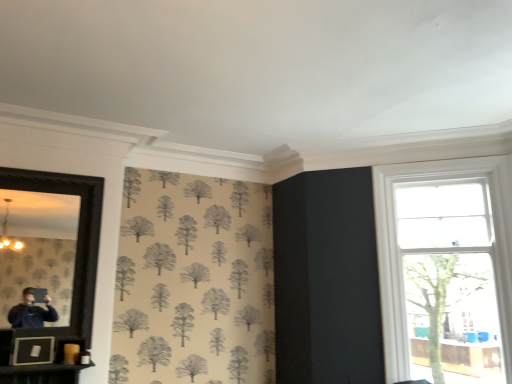
This screenshot has width=512, height=384. What do you see at coordinates (33, 350) in the screenshot?
I see `matte black picture frame at lower left` at bounding box center [33, 350].

This screenshot has width=512, height=384. Describe the element at coordinates (446, 268) in the screenshot. I see `clear glass window at right` at that location.

Where is `black framed mirror at left`? The image size is (512, 384). black framed mirror at left is located at coordinates (39, 249).

Where is `matte black picture frame at lower left`? This screenshot has height=384, width=512. matte black picture frame at lower left is located at coordinates (33, 350).

Can you confirm if matte black picture frame at lower left is positioned to the left of clear glass window at right?

Correct, you'll find matte black picture frame at lower left to the left of clear glass window at right.

Measure the distance between matte black picture frame at lower left and clear glass window at right.

matte black picture frame at lower left is 2.89 meters from clear glass window at right.

Between matte black picture frame at lower left and clear glass window at right, which one has smaller size?

matte black picture frame at lower left.

Which of these two, matte black picture frame at lower left or clear glass window at right, stands taller?

clear glass window at right.

In the scene shown: From the image's perspective, which is above, black framed mirror at left or clear glass window at right?

From the image's view, black framed mirror at left is above.

Does point (50, 291) come behind point (389, 208)?

No.

What's the angular difference between black framed mirror at left and clear glass window at right's facing directions?

There is a 48.1-degree angle between the facing directions of black framed mirror at left and clear glass window at right.

Between black framed mirror at left and clear glass window at right, which one has larger width?

Wider between the two is clear glass window at right.

Does point (425, 285) come closer to viewer compared to point (8, 235)?

No, (425, 285) is behind (8, 235).

From their relative heights in the image, would you say clear glass window at right is taller or shorter than black framed mirror at left?

Considering their sizes, clear glass window at right has more height than black framed mirror at left.

Consider the image. Could you tell me if clear glass window at right is facing black framed mirror at left?

No, clear glass window at right is not facing towards black framed mirror at left.

From a real-world perspective, is black framed mirror at left located beneath matte black picture frame at lower left?

No, from a real-world perspective, black framed mirror at left is not beneath matte black picture frame at lower left.

Would you say black framed mirror at left is a long distance from matte black picture frame at lower left?

black framed mirror at left is near matte black picture frame at lower left, not far away.

Looking at this image, is matte black picture frame at lower left completely or partially inside black framed mirror at left?

That's correct, matte black picture frame at lower left is inside black framed mirror at left.

Between black framed mirror at left and matte black picture frame at lower left, which one appears on the right side from the viewer's perspective?

From the viewer's perspective, matte black picture frame at lower left appears more on the right side.

Is matte black picture frame at lower left with black framed mirror at left?

No, matte black picture frame at lower left is not making contact with black framed mirror at left.

Is black framed mirror at left at the back of matte black picture frame at lower left?

Yes.

Is matte black picture frame at lower left thinner than black framed mirror at left?

No.

From the picture: How many degrees apart are the facing directions of matte black picture frame at lower left and black framed mirror at left?

The angular difference between matte black picture frame at lower left and black framed mirror at left is 0.573 degrees.

Considering the positions of points (435, 287) and (42, 352), is point (435, 287) closer to camera compared to point (42, 352)?

No, it is not.

From the image's perspective, does clear glass window at right appear lower than matte black picture frame at lower left?

No, from the image's perspective, clear glass window at right is not below matte black picture frame at lower left.

Can you confirm if clear glass window at right is bigger than matte black picture frame at lower left?

Yes.

Which object is further away from the camera taking this photo, clear glass window at right or matte black picture frame at lower left?

clear glass window at right is further away from the camera.

Identify the location of picture frame in front of the clear glass window at right. (33, 350).

At what (x,y) coordinates should I click in order to perform the action: click on mirror to the left of clear glass window at right. Please return your answer as a coordinate pair (x, y). Looking at the image, I should click on (39, 249).

Estimate the real-world distances between objects in this image. Which object is further from black framed mirror at left, clear glass window at right or matte black picture frame at lower left?

Among the two, clear glass window at right is located further to black framed mirror at left.

Looking at the image, which one is located closer to clear glass window at right, black framed mirror at left or matte black picture frame at lower left?

The object closer to clear glass window at right is black framed mirror at left.

Which object lies further to the anchor point black framed mirror at left, matte black picture frame at lower left or clear glass window at right?

clear glass window at right is further to black framed mirror at left.

In the scene shown: Looking at the image, which one is located further to clear glass window at right, matte black picture frame at lower left or black framed mirror at left?

Among the two, matte black picture frame at lower left is located further to clear glass window at right.

Considering their positions, is black framed mirror at left positioned closer to matte black picture frame at lower left than clear glass window at right?

Based on the image, black framed mirror at left appears to be nearer to matte black picture frame at lower left.

From the image, which object appears to be farther from matte black picture frame at lower left, clear glass window at right or black framed mirror at left?

clear glass window at right.

Locate an element on the screen. The image size is (512, 384). picture frame situated between black framed mirror at left and clear glass window at right from left to right is located at coordinates (x=33, y=350).